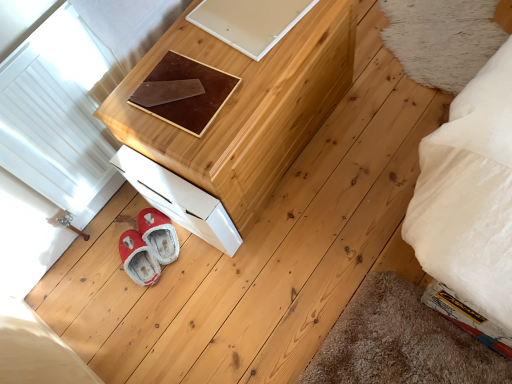
Image resolution: width=512 pixels, height=384 pixels. Find the location of `empty space that is to the right of fuzzy red slippers at lower left`. empty space that is to the right of fuzzy red slippers at lower left is located at coordinates (170, 247).